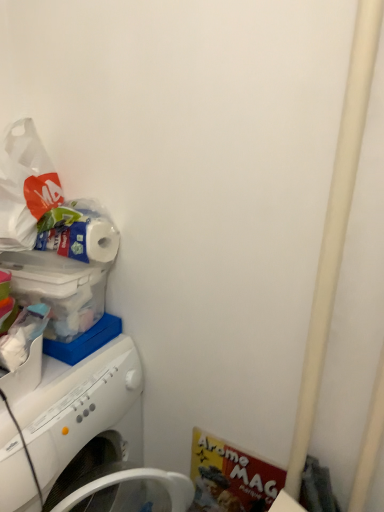
Question: From a real-world perspective, is white plastic washing machine at left physically above white matte toilet paper at upper left?

Choices:
 (A) no
 (B) yes

Answer: (A)

Question: Is white plastic washing machine at left at the right side of white matte toilet paper at upper left?

Choices:
 (A) no
 (B) yes

Answer: (A)

Question: Is white plastic washing machine at left not within white matte toilet paper at upper left?

Choices:
 (A) yes
 (B) no

Answer: (A)

Question: From the image's perspective, is white plastic washing machine at left under white matte toilet paper at upper left?

Choices:
 (A) no
 (B) yes

Answer: (B)

Question: Is white plastic washing machine at left oriented away from white matte toilet paper at upper left?

Choices:
 (A) yes
 (B) no

Answer: (B)

Question: Can you confirm if white plastic washing machine at left is shorter than white matte toilet paper at upper left?

Choices:
 (A) yes
 (B) no

Answer: (B)

Question: Is white matte toilet paper at upper left wider than white plastic washing machine at left?

Choices:
 (A) no
 (B) yes

Answer: (A)

Question: Is white plastic washing machine at left at the back of white matte toilet paper at upper left?

Choices:
 (A) no
 (B) yes

Answer: (A)

Question: Would you say white plastic washing machine at left is part of white matte toilet paper at upper left's contents?

Choices:
 (A) yes
 (B) no

Answer: (B)

Question: Is white matte toilet paper at upper left touching white plastic washing machine at left?

Choices:
 (A) no
 (B) yes

Answer: (A)

Question: Does white matte toilet paper at upper left have a greater height compared to white plastic washing machine at left?

Choices:
 (A) yes
 (B) no

Answer: (B)

Question: Considering the relative sizes of white matte toilet paper at upper left and white plastic washing machine at left in the image provided, is white matte toilet paper at upper left smaller than white plastic washing machine at left?

Choices:
 (A) yes
 (B) no

Answer: (A)

Question: In terms of width, does white plastic washing machine at left look wider or thinner when compared to white matte toilet paper at upper left?

Choices:
 (A) wide
 (B) thin

Answer: (A)